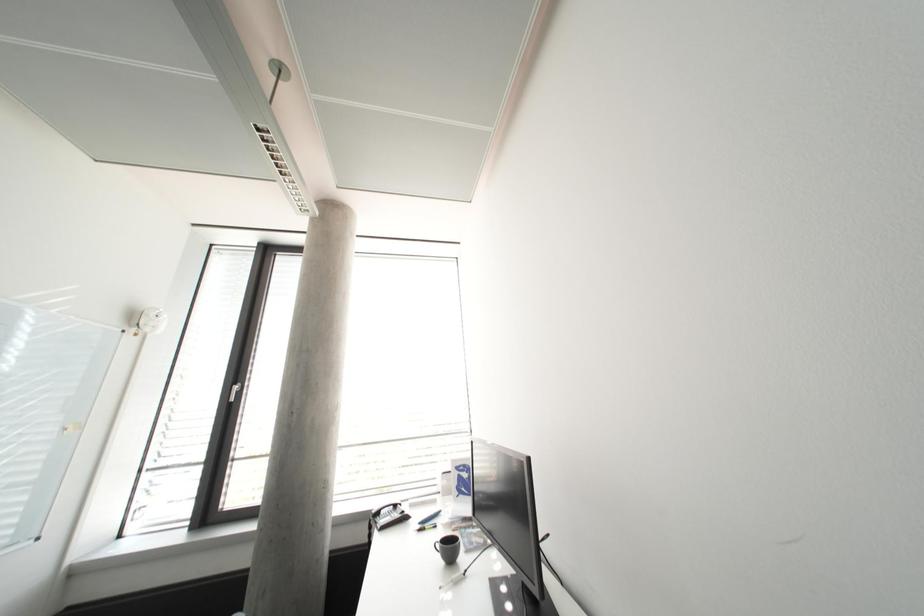
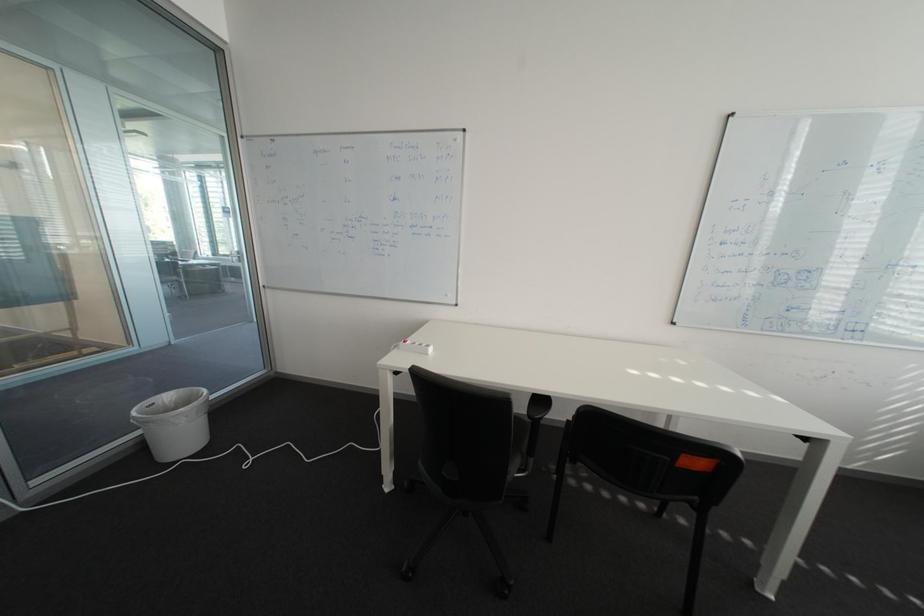
Question: The first image is from the beginning of the video and the second image is from the end. How did the camera likely rotate when shooting the video?

Choices:
 (A) Left
 (B) Right
 (C) Up
 (D) Down

Answer: (A)